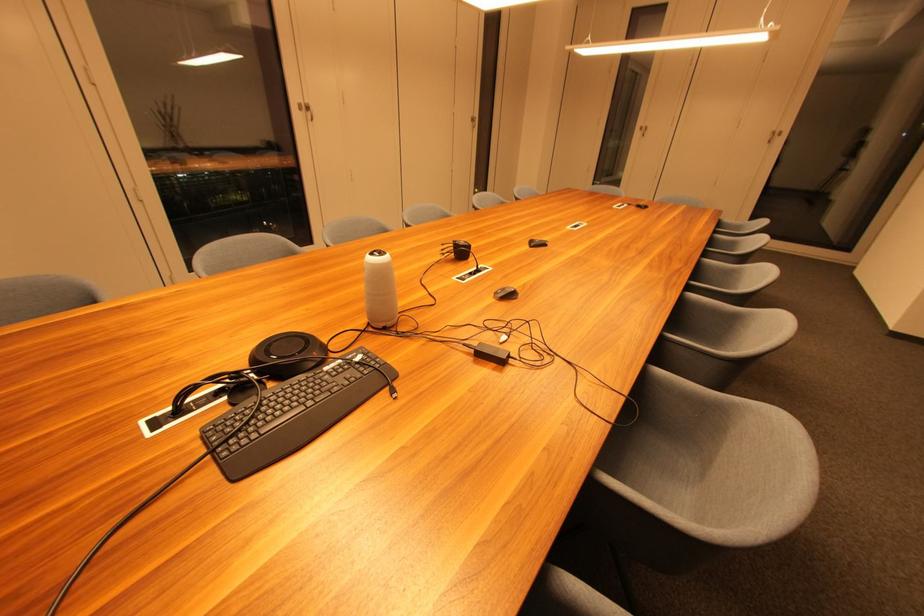
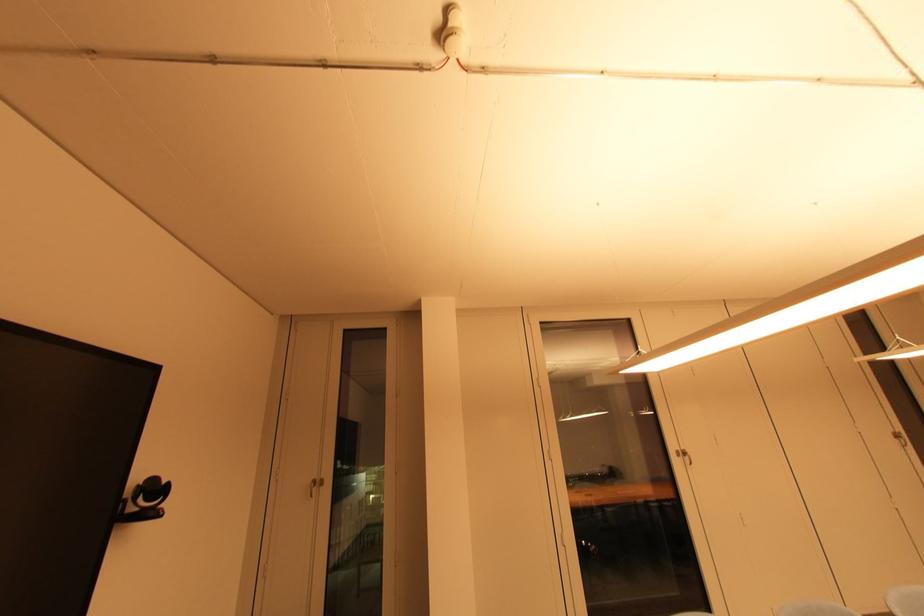
First-person continuous shooting, in which direction is the camera rotating?

The rotation direction of the camera is left-up.